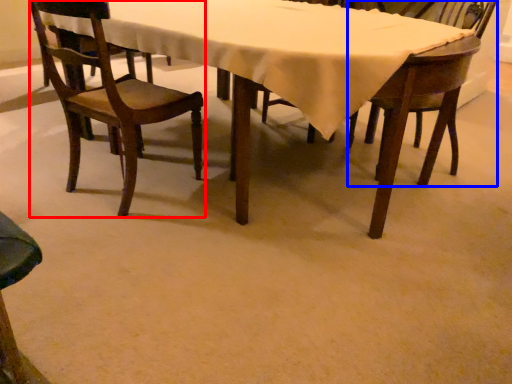
Question: Which object appears farthest to the camera in this image, chair (highlighted by a red box) or chair (highlighted by a blue box)?

Choices:
 (A) chair
 (B) chair

Answer: (B)